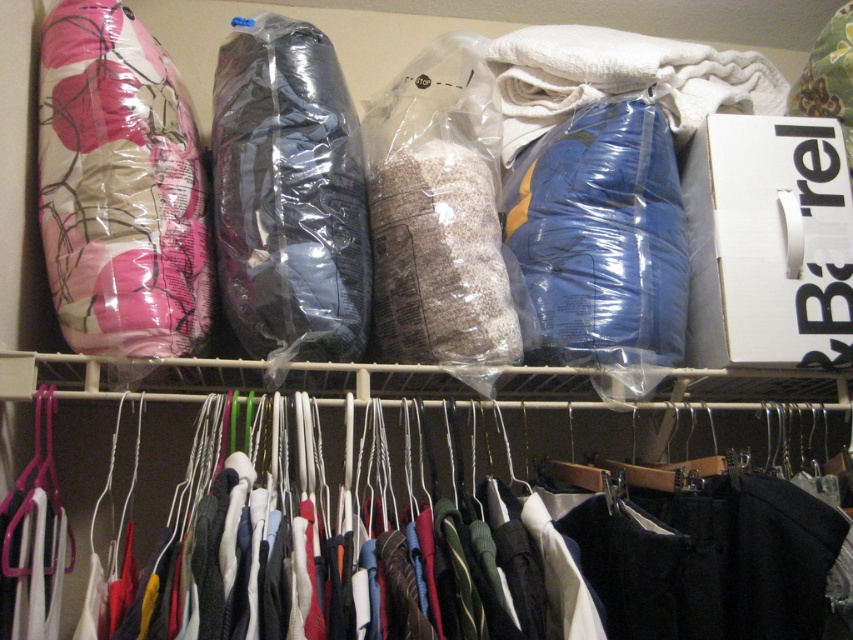
Can you confirm if polyester hangers at center is positioned above pink floral fabric pillow at upper left?

No.

Which is below, polyester hangers at center or pink floral fabric pillow at upper left?

polyester hangers at center is below.

Locate an element on the screen. The height and width of the screenshot is (640, 853). polyester hangers at center is located at coordinates (485, 547).

From the picture: Who is positioned more to the right, pink floral fabric pillow at upper left or white textured blanket at upper right?

white textured blanket at upper right is more to the right.

Does point (70, 280) lie in front of point (683, 49)?

Yes, point (70, 280) is closer to viewer.

Where is `pink floral fabric pillow at upper left`? Image resolution: width=853 pixels, height=640 pixels. pink floral fabric pillow at upper left is located at coordinates (119, 188).

Is point (136, 324) closer to viewer compared to point (263, 125)?

Yes, it is in front of point (263, 125).

Between pink floral fabric pillow at upper left and matte black sleeping bag at center, which one appears on the right side from the viewer's perspective?

From the viewer's perspective, matte black sleeping bag at center appears more on the right side.

Who is more forward, (138, 136) or (277, 349)?

Point (277, 349) is more forward.

The height and width of the screenshot is (640, 853). What are the coordinates of `pink floral fabric pillow at upper left` in the screenshot? It's located at (119, 188).